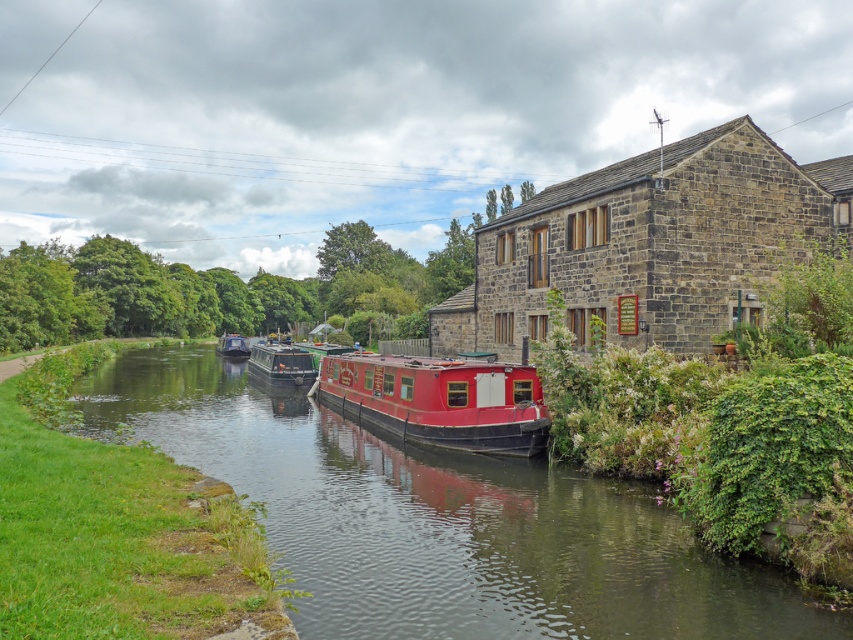
You are a photographer planning to capture the canal scene. You want to ensure that the smooth water at center and the matte black boat at center are both visible in your shot. Based on their sizes in the image, which object should you prioritize framing closer to the edge of the photo?

The smooth water at center occupies less space than the matte black boat at center, so you should prioritize framing the smooth water at center closer to the edge of the photo to ensure both fit within the frame.

Consider the image. You are a boat operator who needs to navigate a new boat through the canal. You see the smooth water at center and the metallic gray barge at center. Which area would you choose to navigate your boat through, and why?

You should navigate your boat through the smooth water at center because it is larger than the metallic gray barge at center, providing more space for safe passage.